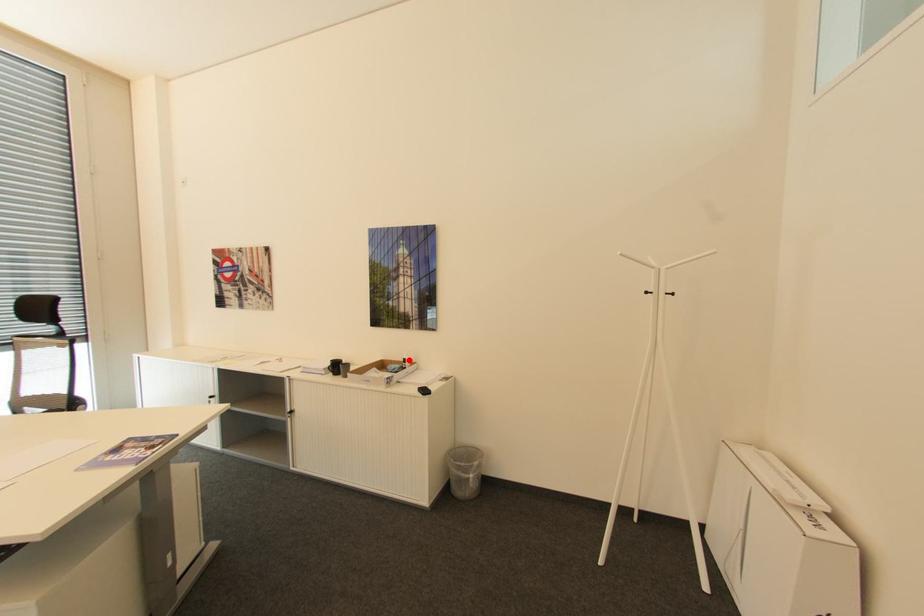
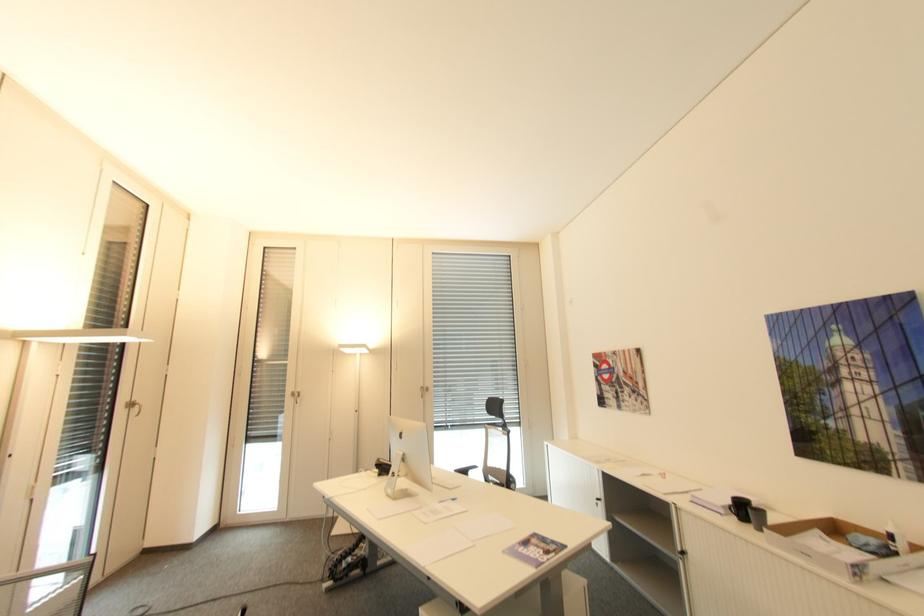
Question: A red point is marked in image1. In image2, is the corresponding 3D point closer to the camera or farther? Reply with the corresponding letter.

Choices:
 (A) The corresponding 3D point is closer.
 (B) The corresponding 3D point is farther.

Answer: (A)